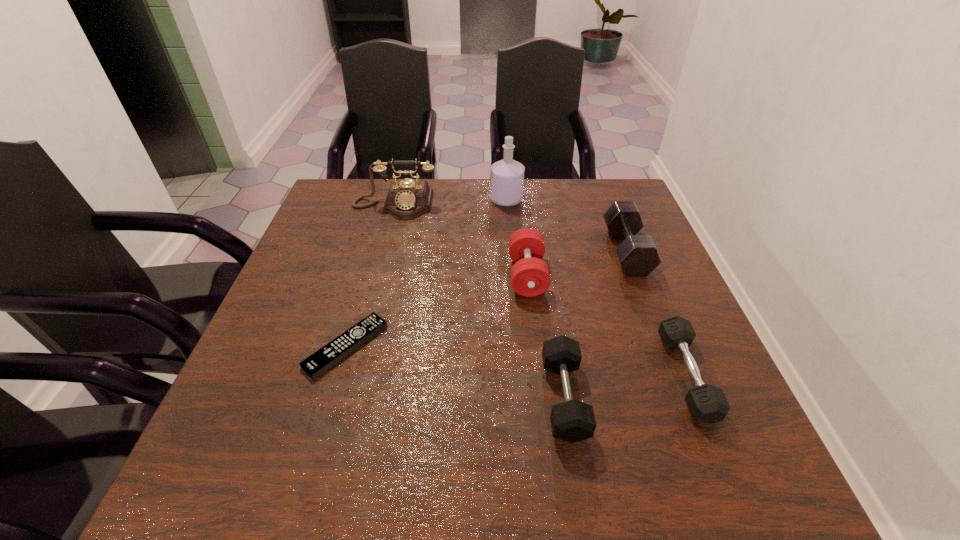
You are a GUI agent. You are given a task and a screenshot of the screen. Output one action in this format:
    pyautogui.click(x=<x>, y=<y>)
    Task: Click on the telephone located in the left edge section of the desktop
    The height and width of the screenshot is (540, 960).
    Given the screenshot: What is the action you would take?
    pyautogui.click(x=407, y=199)

Where is `remote control present at the left edge`? The width and height of the screenshot is (960, 540). remote control present at the left edge is located at coordinates (316, 364).

Find the location of a particular element. The width and height of the screenshot is (960, 540). object at the far left corner is located at coordinates (407, 199).

Where is `free space at the far edge`? This screenshot has height=540, width=960. free space at the far edge is located at coordinates (453, 203).

Image resolution: width=960 pixels, height=540 pixels. Identify the location of blank space at the left edge of the desktop. (223, 408).

The width and height of the screenshot is (960, 540). Find the location of `free space at the right edge of the desktop`. free space at the right edge of the desktop is located at coordinates (672, 388).

I want to click on free region at the far left corner, so click(x=360, y=189).

The height and width of the screenshot is (540, 960). In the image, there is a desktop. What are the coordinates of `free space at the near left corner` in the screenshot? It's located at (226, 458).

Identify the location of vacant position at the far right corner of the desktop. (585, 204).

Locate an element on the screen. free spot between the telephone and the remote control is located at coordinates (371, 276).